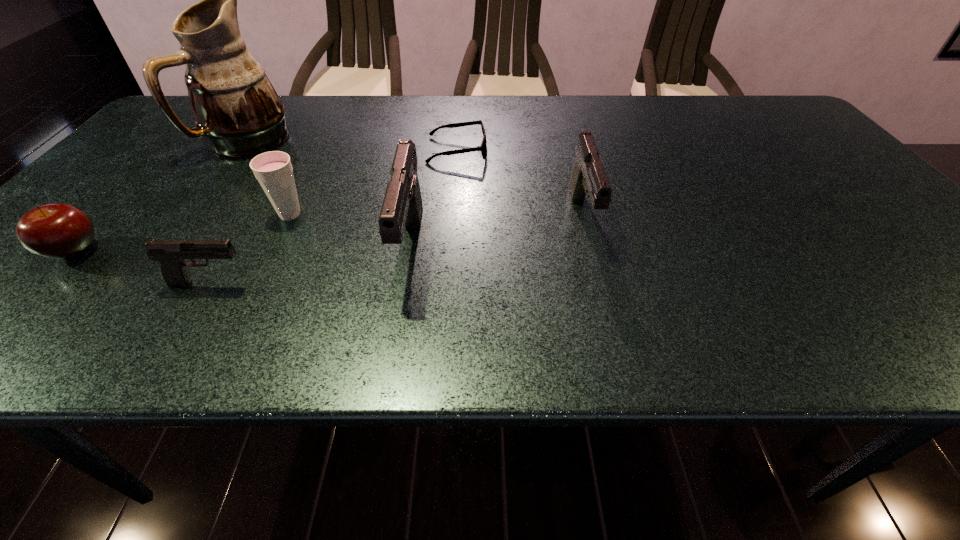
Where is `blank space located 0.110m from the spout of the pitcher`? blank space located 0.110m from the spout of the pitcher is located at coordinates (212, 194).

You are a GUI agent. You are given a task and a screenshot of the screen. Output one action in this format:
    pyautogui.click(x=<x>, y=<y>)
    Task: Click on the free space located 0.070m on the front-facing side of the sunglasses
    This screenshot has width=960, height=540.
    Given the screenshot: What is the action you would take?
    pyautogui.click(x=514, y=151)

The height and width of the screenshot is (540, 960). I want to click on free space located 0.360m on the back of the leftmost object, so click(173, 147).

Where is `blank space located 0.370m on the left of the fourth shortest object`? blank space located 0.370m on the left of the fourth shortest object is located at coordinates (107, 215).

Identify the location of object that is positioned at the far edge. Image resolution: width=960 pixels, height=540 pixels. (235, 106).

Where is `apple located at the near edge`? This screenshot has width=960, height=540. apple located at the near edge is located at coordinates (60, 231).

Locate an element on the screen. Image resolution: width=960 pixels, height=540 pixels. object that is at the left edge is located at coordinates (60, 231).

Identify the location of object positioned at the near left corner. Image resolution: width=960 pixels, height=540 pixels. (60, 231).

This screenshot has width=960, height=540. Find the location of `vacant space at the far edge of the desktop`. vacant space at the far edge of the desktop is located at coordinates (597, 110).

The width and height of the screenshot is (960, 540). Find the location of `free space at the near edge of the desktop`. free space at the near edge of the desktop is located at coordinates (520, 294).